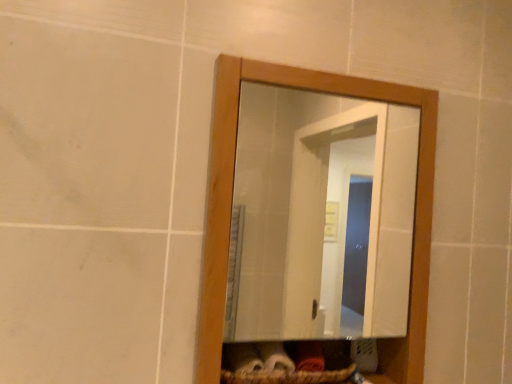
Question: Considering their positions, is wooden mirror at center located in front of or behind brown woven basket at lower center?

Choices:
 (A) behind
 (B) front

Answer: (B)

Question: Does point (248, 84) appear closer or farther from the camera than point (225, 370)?

Choices:
 (A) farther
 (B) closer

Answer: (A)

Question: Is wooden mirror at center to the left or to the right of brown woven basket at lower center in the image?

Choices:
 (A) right
 (B) left

Answer: (A)

Question: Looking at their shapes, would you say brown woven basket at lower center is wider or thinner than wooden mirror at center?

Choices:
 (A) wide
 (B) thin

Answer: (A)

Question: Is brown woven basket at lower center to the left or to the right of wooden mirror at center in the image?

Choices:
 (A) right
 (B) left

Answer: (B)

Question: From a real-world perspective, relative to wooden mirror at center, is brown woven basket at lower center vertically above or below?

Choices:
 (A) below
 (B) above

Answer: (A)

Question: From the image's perspective, relative to wooden mirror at center, is brown woven basket at lower center above or below?

Choices:
 (A) above
 (B) below

Answer: (B)